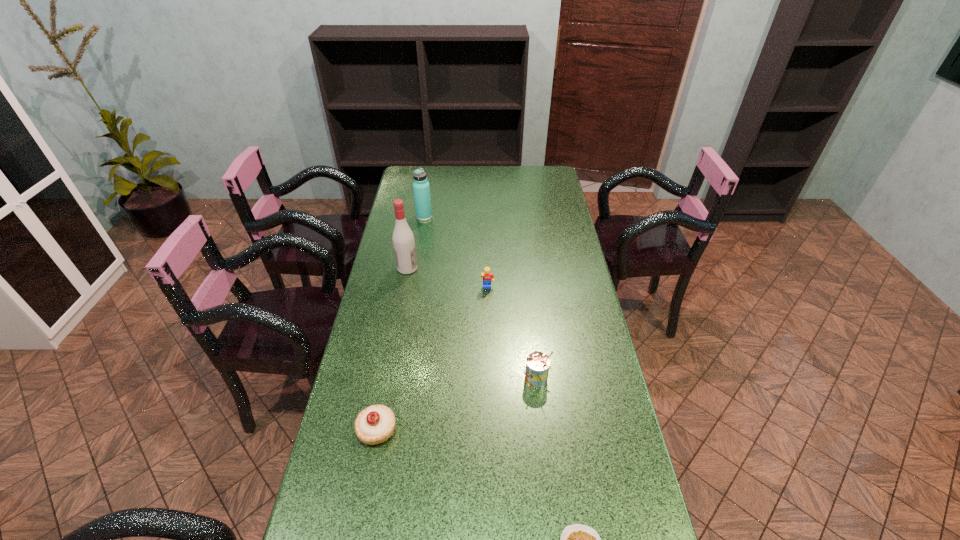
Identify the location of free space located on the back of the farthest object. (427, 200).

The image size is (960, 540). Find the location of `vacant space located on the right of the fourth farthest object`. vacant space located on the right of the fourth farthest object is located at coordinates (587, 379).

The height and width of the screenshot is (540, 960). Find the location of `free space located 0.290m on the face of the fourth nearest object`. free space located 0.290m on the face of the fourth nearest object is located at coordinates (489, 359).

The height and width of the screenshot is (540, 960). I want to click on free space located 0.150m on the front of the fifth farthest object, so click(362, 513).

Find the location of `alcohol that is at the left edge`. alcohol that is at the left edge is located at coordinates (403, 240).

Image resolution: width=960 pixels, height=540 pixels. In order to click on thermos bottle present at the left edge in this screenshot , I will do `click(421, 188)`.

This screenshot has height=540, width=960. What are the coordinates of `pastry positioned at the left edge` in the screenshot? It's located at (375, 424).

The width and height of the screenshot is (960, 540). In the image, there is a desktop. What are the coordinates of `free space at the far edge` in the screenshot? It's located at (446, 182).

In the image, there is a desktop. Where is `vacant area at the left edge`? Image resolution: width=960 pixels, height=540 pixels. vacant area at the left edge is located at coordinates (358, 378).

Identify the location of free space at the right edge of the desktop. (566, 417).